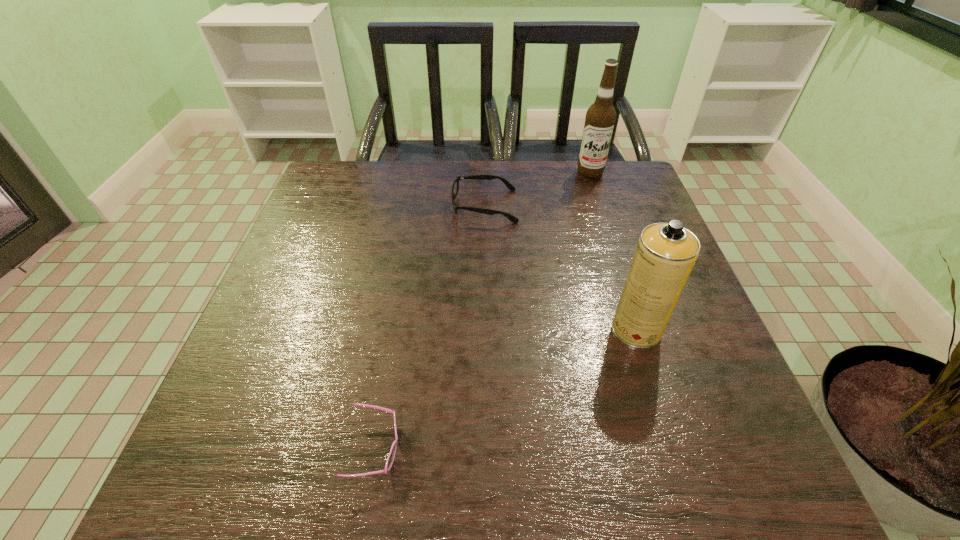
You are a GUI agent. You are given a task and a screenshot of the screen. Output one action in this format:
    pyautogui.click(x=<x>, y=<y>)
    Task: Click on the free space between the alcohol and the third object from right to left
    The height and width of the screenshot is (540, 960).
    Given the screenshot: What is the action you would take?
    pyautogui.click(x=538, y=189)

You are a GUI agent. You are given a task and a screenshot of the screen. Output one action in this format:
    pyautogui.click(x=<x>, y=<y>)
    Task: Click on the vacant point located between the third farthest object and the second object from left to right
    
    Given the screenshot: What is the action you would take?
    pyautogui.click(x=561, y=268)

The height and width of the screenshot is (540, 960). I want to click on free space between the farthest object and the second tallest object, so coord(613,251).

At what (x,y) coordinates should I click in order to perform the action: click on free spot between the third nearest object and the third farthest object. Please return your answer as a coordinate pair (x, y). The height and width of the screenshot is (540, 960). Looking at the image, I should click on (561, 268).

Locate an element on the screen. The image size is (960, 540). object that stands as the third closest to the aerosol can is located at coordinates point(600,118).

This screenshot has height=540, width=960. In order to click on object that can be found as the third closest to the nearest object in this screenshot , I will do `click(600, 118)`.

This screenshot has height=540, width=960. I want to click on vacant space that satisfies the following two spatial constraints: 1. on the front-facing side of the spectacles; 2. on the right side of the third shortest object, so [486, 329].

Find the location of a particular element. Image resolution: width=960 pixels, height=540 pixels. vacant area in the image that satisfies the following two spatial constraints: 1. on the label of the farthest object; 2. on the front-facing side of the nearest object is located at coordinates (681, 449).

Image resolution: width=960 pixels, height=540 pixels. I want to click on vacant space that satisfies the following two spatial constraints: 1. on the label of the alcohol; 2. on the front-facing side of the second object from left to right, so click(601, 206).

Where is `free point that satisfies the following two spatial constraints: 1. on the front side of the second tallest object; 2. on the front-facing side of the nearest object`? free point that satisfies the following two spatial constraints: 1. on the front side of the second tallest object; 2. on the front-facing side of the nearest object is located at coordinates (674, 449).